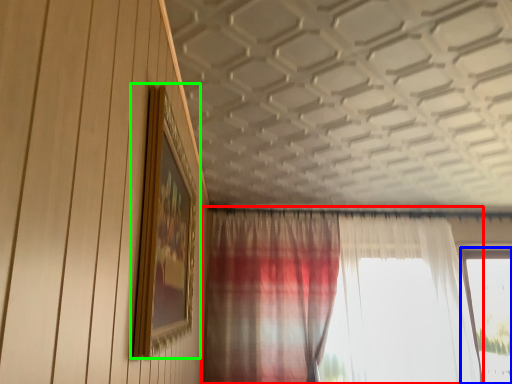
Question: Which object is positioned farthest from curtain (highlighted by a red box)? Select from window (highlighted by a blue box) and picture frame (highlighted by a green box).

Choices:
 (A) window
 (B) picture frame

Answer: (B)